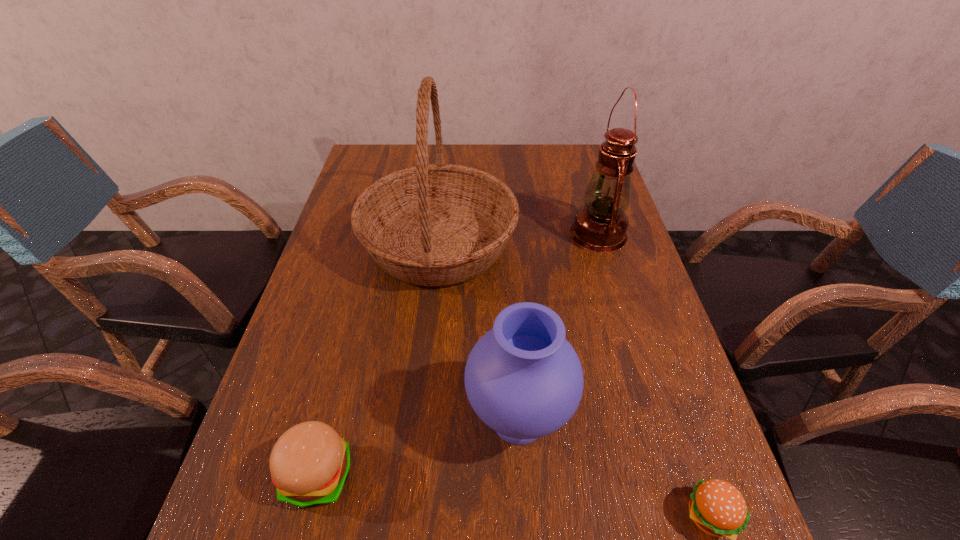
Locate an element on the screen. This screenshot has width=960, height=540. the second closest object relative to the third shortest object is located at coordinates (440, 224).

This screenshot has height=540, width=960. I want to click on object that is the fourth nearest to the third tallest object, so click(600, 226).

Where is `vacant space that satisfies the following two spatial constraints: 1. on the front side of the basket; 2. on the right side of the vase`? vacant space that satisfies the following two spatial constraints: 1. on the front side of the basket; 2. on the right side of the vase is located at coordinates (421, 420).